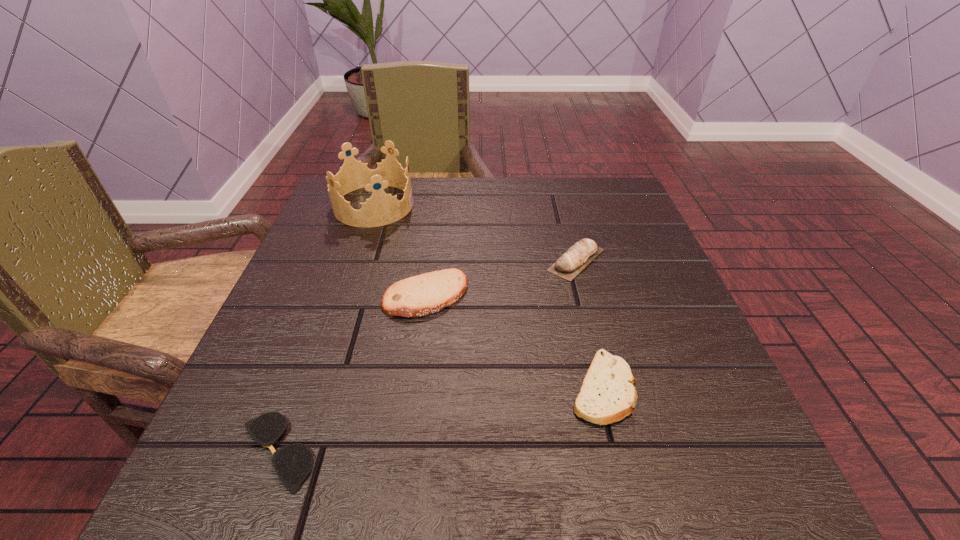
I want to click on blank space that satisfies the following two spatial constraints: 1. on the front-facing side of the tallest object; 2. on the right side of the leftmost pita bread, so click(342, 296).

The width and height of the screenshot is (960, 540). Identify the location of vacant region that satisfies the following two spatial constraints: 1. on the back side of the fourth tallest object; 2. on the front-facing side of the farthest object. 558,205.